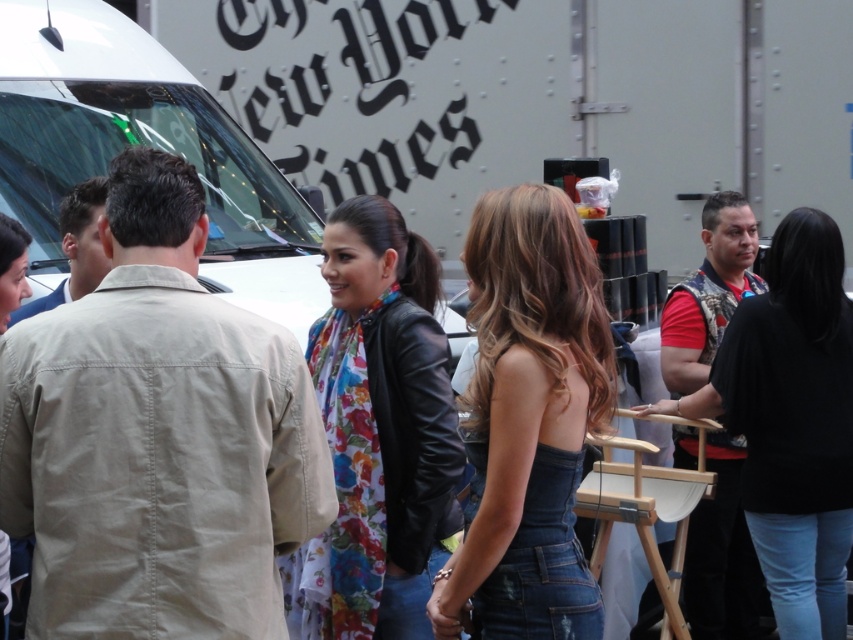
Question: Which point is farther from the camera taking this photo?

Choices:
 (A) (405, 323)
 (B) (495, 611)
 (C) (6, 230)
 (D) (795, 592)

Answer: (D)

Question: Is denim strapless top at center thinner than floral scarf at center?

Choices:
 (A) yes
 (B) no

Answer: (B)

Question: Based on their relative distances, which object is nearer to the floral fabric scarf at center?

Choices:
 (A) black leather jacket at right
 (B) denim strapless top at center

Answer: (B)

Question: Can you confirm if denim strapless top at center is wider than floral scarf at center?

Choices:
 (A) no
 (B) yes

Answer: (B)

Question: Is floral fabric scarf at center in front of floral scarf at center?

Choices:
 (A) yes
 (B) no

Answer: (B)

Question: Which of these objects is positioned farthest from the denim strapless top at center?

Choices:
 (A) floral fabric scarf at center
 (B) black leather jacket at right

Answer: (B)